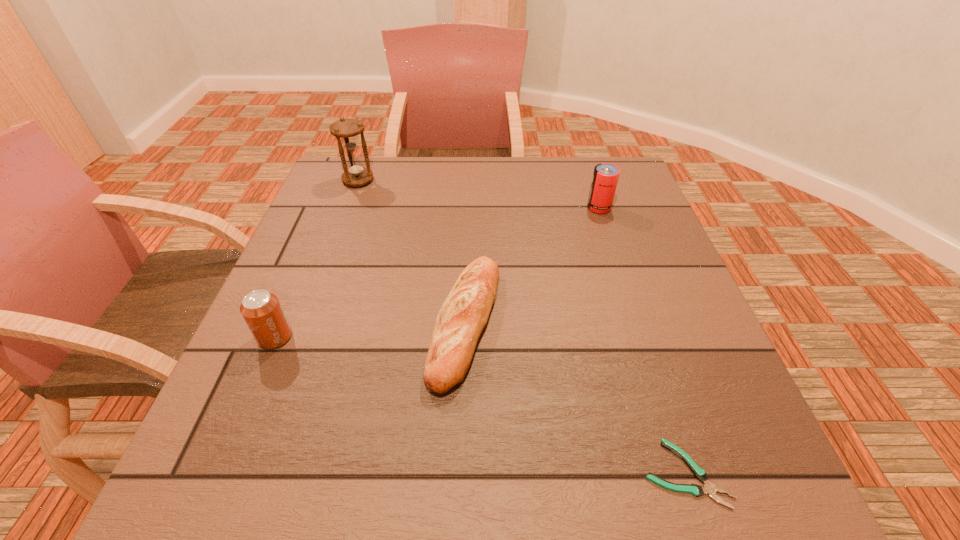
I want to click on pliers that is at the right edge, so click(708, 488).

The width and height of the screenshot is (960, 540). I want to click on object that is at the far left corner, so click(346, 131).

Locate an element on the screen. Image resolution: width=960 pixels, height=540 pixels. object present at the far right corner is located at coordinates (605, 177).

Locate an element on the screen. object at the near right corner is located at coordinates (708, 488).

Image resolution: width=960 pixels, height=540 pixels. I want to click on vacant position at the far edge of the desktop, so point(429,185).

In the image, there is a desktop. Identify the location of blank space at the near edge. The image size is (960, 540). (584, 480).

What are the coordinates of `free space at the left edge of the desktop` in the screenshot? It's located at (245, 411).

The image size is (960, 540). Identify the location of vacant point at the right edge. [x=617, y=206].

This screenshot has width=960, height=540. Find the location of `vacant space at the far left corner of the desktop`. vacant space at the far left corner of the desktop is located at coordinates (372, 157).

This screenshot has width=960, height=540. I want to click on vacant space at the far right corner of the desktop, so click(x=629, y=188).